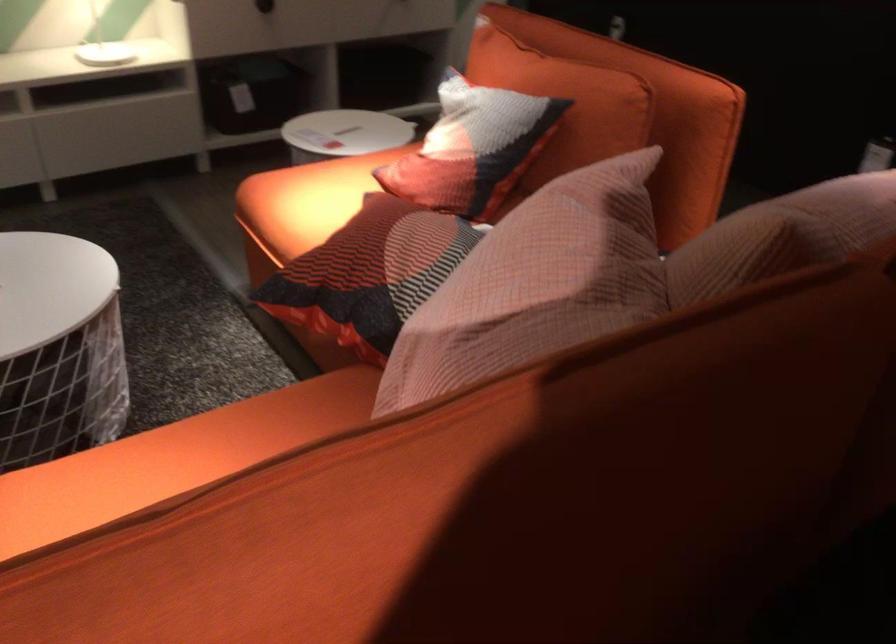
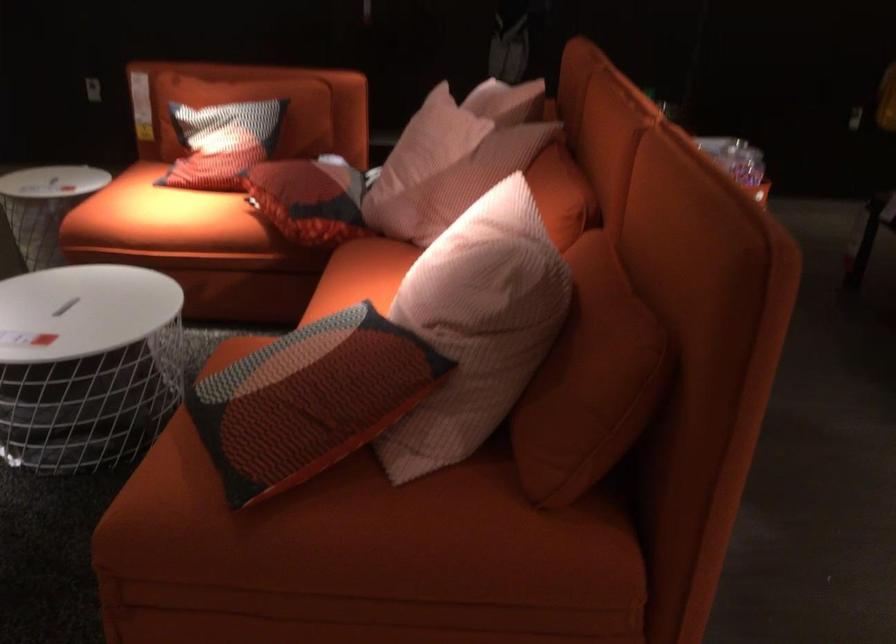
Find the pixel in the second image that matches pixel 225 442 in the first image.

(360, 276)